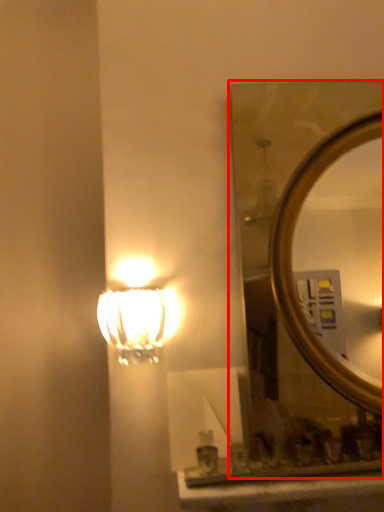
Question: From the image's perspective, what is the correct spatial positioning of mirror (annotated by the red box) in reference to lamp?

Choices:
 (A) below
 (B) above

Answer: (B)